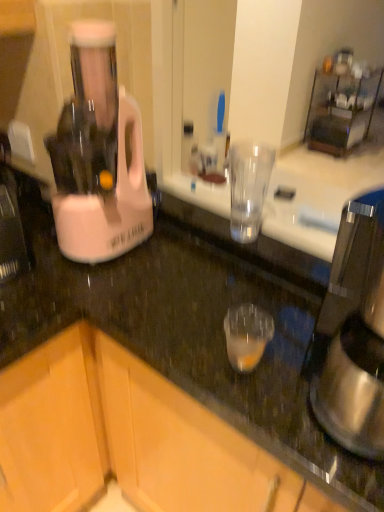
At what (x,y) coordinates should I click in order to perform the action: click on wooden cabinet at lower left, acting as the second cabinetry starting from the left. Please return your answer as a coordinate pair (x, y). The image size is (384, 512). Looking at the image, I should click on (127, 438).

You are a GUI agent. You are given a task and a screenshot of the screen. Output one action in this format:
    pyautogui.click(x=<x>, y=<y>)
    Task: Click on the satin silver coffee maker at right
    The width and height of the screenshot is (384, 512).
    Given the screenshot: What is the action you would take?
    pyautogui.click(x=354, y=333)

Describe the element at coordinates (98, 155) in the screenshot. I see `pink plastic blender at left` at that location.

I want to click on wooden cabinet at lower left, which is counted as the 1th cabinetry, starting from the right, so click(x=127, y=438).

Is wooden cabinet at lower left, which ranks as the 2th cabinetry in right-to-left order, touching pink plastic blender at left?

No, wooden cabinet at lower left, which ranks as the 2th cabinetry in right-to-left order, is not touching pink plastic blender at left.

From the image's perspective, which one is positioned lower, wooden cabinet at lower left, which ranks as the 2th cabinetry in right-to-left order, or pink plastic blender at left?

wooden cabinet at lower left, which ranks as the 2th cabinetry in right-to-left order.

Is wooden cabinet at lower left, which ranks as the first cabinetry in left-to-right order, wider or thinner than pink plastic blender at left?

wooden cabinet at lower left, which ranks as the first cabinetry in left-to-right order, is wider than pink plastic blender at left.

Consider the image. Can we say satin silver coffee maker at right lies outside wooden cabinet at lower left, which is counted as the 1th cabinetry, starting from the right?

satin silver coffee maker at right is positioned outside wooden cabinet at lower left, which is counted as the 1th cabinetry, starting from the right.

Locate an element on the screen. coffee maker in front of the wooden cabinet at lower left, acting as the second cabinetry starting from the left is located at coordinates (354, 333).

Is satin silver coffee maker at right shorter than wooden cabinet at lower left, which is counted as the 1th cabinetry, starting from the right?

Correct, satin silver coffee maker at right is not as tall as wooden cabinet at lower left, which is counted as the 1th cabinetry, starting from the right.

From a real-world perspective, who is located lower, satin silver coffee maker at right or wooden cabinet at lower left, which is counted as the 1th cabinetry, starting from the right?

In real-world perspective, wooden cabinet at lower left, which is counted as the 1th cabinetry, starting from the right, is lower.

From a real-world perspective, between wooden cabinet at lower left, which ranks as the 2th cabinetry in right-to-left order, and satin silver coffee maker at right, who is vertically higher?

satin silver coffee maker at right is physically above.

Does point (7, 430) lie behind point (364, 323)?

That is True.

Looking at their sizes, would you say wooden cabinet at lower left, which ranks as the first cabinetry in left-to-right order, is wider or thinner than satin silver coffee maker at right?

wooden cabinet at lower left, which ranks as the first cabinetry in left-to-right order, is wider than satin silver coffee maker at right.

In terms of size, does wooden cabinet at lower left, which ranks as the 2th cabinetry in right-to-left order, appear bigger or smaller than satin silver coffee maker at right?

wooden cabinet at lower left, which ranks as the 2th cabinetry in right-to-left order, is bigger than satin silver coffee maker at right.

Based on the photo, is pink plastic blender at left at the left side of satin silver coffee maker at right?

Indeed, pink plastic blender at left is positioned on the left side of satin silver coffee maker at right.

In order to click on coffee maker located in front of the pink plastic blender at left in this screenshot , I will do `click(354, 333)`.

Is pink plastic blender at left inside the boundaries of satin silver coffee maker at right, or outside?

pink plastic blender at left is outside satin silver coffee maker at right.

From the image's perspective, is pink plastic blender at left over satin silver coffee maker at right?

Yes, from the image's perspective, pink plastic blender at left is on top of satin silver coffee maker at right.

Does point (367, 353) appear closer or farther from the camera than point (86, 225)?

Point (367, 353) appears to be closer to the viewer than point (86, 225).

Considering the sizes of satin silver coffee maker at right and pink plastic blender at left in the image, is satin silver coffee maker at right bigger or smaller than pink plastic blender at left?

Clearly, satin silver coffee maker at right is smaller in size than pink plastic blender at left.

Which object is thinner, satin silver coffee maker at right or pink plastic blender at left?

pink plastic blender at left.

The image size is (384, 512). What are the coordinates of `coffee maker above the wooden cabinet at lower left, acting as the second cabinetry starting from the left (from a real-world perspective)` in the screenshot? It's located at (354, 333).

Based on the photo, is wooden cabinet at lower left, acting as the second cabinetry starting from the left, directly adjacent to satin silver coffee maker at right?

wooden cabinet at lower left, acting as the second cabinetry starting from the left, and satin silver coffee maker at right are not in contact.

Is point (38, 409) positioned behind point (39, 470)?

No, (38, 409) is in front of (39, 470).

Is wooden cabinet at lower left, which ranks as the 2th cabinetry in right-to-left order, aimed at wooden cabinet at lower left, which is counted as the 1th cabinetry, starting from the right?

Yes, wooden cabinet at lower left, which ranks as the 2th cabinetry in right-to-left order, faces towards wooden cabinet at lower left, which is counted as the 1th cabinetry, starting from the right.

Locate an element on the screen. cabinetry located above the wooden cabinet at lower left, which ranks as the 2th cabinetry in right-to-left order (from a real-world perspective) is located at coordinates (127, 438).

Identify the location of cabinetry behind the pink plastic blender at left. [x=52, y=426].

Where is `coffee maker above the wooden cabinet at lower left, which is counted as the 1th cabinetry, starting from the right (from a real-world perspective)`? The height and width of the screenshot is (512, 384). coffee maker above the wooden cabinet at lower left, which is counted as the 1th cabinetry, starting from the right (from a real-world perspective) is located at coordinates (354, 333).

Based on their spatial positions, is pink plastic blender at left or wooden cabinet at lower left, which is counted as the 1th cabinetry, starting from the right, closer to wooden cabinet at lower left, which ranks as the first cabinetry in left-to-right order?

wooden cabinet at lower left, which is counted as the 1th cabinetry, starting from the right.

Based on their spatial positions, is wooden cabinet at lower left, acting as the second cabinetry starting from the left, or satin silver coffee maker at right further from pink plastic blender at left?

satin silver coffee maker at right is positioned further to the anchor pink plastic blender at left.

Which object lies nearer to the anchor point wooden cabinet at lower left, acting as the second cabinetry starting from the left, satin silver coffee maker at right or pink plastic blender at left?

Based on the image, pink plastic blender at left appears to be nearer to wooden cabinet at lower left, acting as the second cabinetry starting from the left.

Estimate the real-world distances between objects in this image. Which object is closer to wooden cabinet at lower left, which is counted as the 1th cabinetry, starting from the right, wooden cabinet at lower left, which ranks as the first cabinetry in left-to-right order, or satin silver coffee maker at right?

Among the two, wooden cabinet at lower left, which ranks as the first cabinetry in left-to-right order, is located nearer to wooden cabinet at lower left, which is counted as the 1th cabinetry, starting from the right.

From the image, which object appears to be farther from satin silver coffee maker at right, pink plastic blender at left or wooden cabinet at lower left, which ranks as the 2th cabinetry in right-to-left order?

Among the two, wooden cabinet at lower left, which ranks as the 2th cabinetry in right-to-left order, is located further to satin silver coffee maker at right.

Based on their spatial positions, is wooden cabinet at lower left, which ranks as the 2th cabinetry in right-to-left order, or pink plastic blender at left closer to wooden cabinet at lower left, which is counted as the 1th cabinetry, starting from the right?

wooden cabinet at lower left, which ranks as the 2th cabinetry in right-to-left order, is closer to wooden cabinet at lower left, which is counted as the 1th cabinetry, starting from the right.

Based on their spatial positions, is satin silver coffee maker at right or pink plastic blender at left further from wooden cabinet at lower left, which ranks as the 2th cabinetry in right-to-left order?

satin silver coffee maker at right.

Estimate the real-world distances between objects in this image. Which object is further from pink plastic blender at left, satin silver coffee maker at right or wooden cabinet at lower left, acting as the second cabinetry starting from the left?

Among the two, satin silver coffee maker at right is located further to pink plastic blender at left.

Locate an element on the screen. This screenshot has width=384, height=512. blender located between wooden cabinet at lower left, which ranks as the 2th cabinetry in right-to-left order, and satin silver coffee maker at right in the left-right direction is located at coordinates [x=98, y=155].

Where is `coffee maker between pink plastic blender at left and wooden cabinet at lower left, acting as the second cabinetry starting from the left, in the up-down direction`? coffee maker between pink plastic blender at left and wooden cabinet at lower left, acting as the second cabinetry starting from the left, in the up-down direction is located at coordinates (354, 333).

This screenshot has height=512, width=384. Identify the location of cabinetry between wooden cabinet at lower left, which ranks as the first cabinetry in left-to-right order, and satin silver coffee maker at right. (127, 438).

Image resolution: width=384 pixels, height=512 pixels. I want to click on cabinetry between pink plastic blender at left and wooden cabinet at lower left, acting as the second cabinetry starting from the left, in the vertical direction, so click(52, 426).